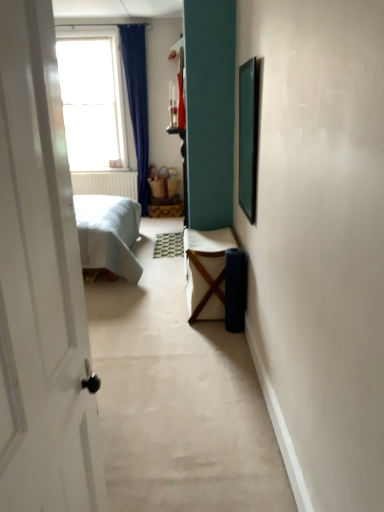
Question: Is green matte picture frame at upper right oriented towards white fabric chair at center?

Choices:
 (A) yes
 (B) no

Answer: (B)

Question: Is green matte picture frame at upper right far away from white fabric chair at center?

Choices:
 (A) yes
 (B) no

Answer: (B)

Question: Is green matte picture frame at upper right with white fabric chair at center?

Choices:
 (A) yes
 (B) no

Answer: (B)

Question: Is the depth of green matte picture frame at upper right greater than that of white fabric chair at center?

Choices:
 (A) yes
 (B) no

Answer: (B)

Question: Is green matte picture frame at upper right to the left of white fabric chair at center from the viewer's perspective?

Choices:
 (A) yes
 (B) no

Answer: (B)

Question: Is white fabric chair at center inside or outside of transparent glass window at upper left?

Choices:
 (A) inside
 (B) outside

Answer: (B)

Question: Based on their positions, is white fabric chair at center located to the left or right of transparent glass window at upper left?

Choices:
 (A) right
 (B) left

Answer: (A)

Question: Is white fabric chair at center in front of or behind transparent glass window at upper left in the image?

Choices:
 (A) behind
 (B) front

Answer: (B)

Question: In terms of width, does white fabric chair at center look wider or thinner when compared to transparent glass window at upper left?

Choices:
 (A) wide
 (B) thin

Answer: (A)

Question: Does point (243, 105) appear closer or farther from the camera than point (215, 261)?

Choices:
 (A) farther
 (B) closer

Answer: (A)

Question: Considering the positions of green matte picture frame at upper right and white fabric chair at center in the image, is green matte picture frame at upper right wider or thinner than white fabric chair at center?

Choices:
 (A) wide
 (B) thin

Answer: (B)

Question: Visually, is green matte picture frame at upper right positioned to the left or to the right of white fabric chair at center?

Choices:
 (A) left
 (B) right

Answer: (B)

Question: Is green matte picture frame at upper right situated inside white fabric chair at center or outside?

Choices:
 (A) inside
 (B) outside

Answer: (B)

Question: Does point pyautogui.click(x=213, y=285) appear closer or farther from the camera than point pyautogui.click(x=249, y=151)?

Choices:
 (A) closer
 (B) farther

Answer: (B)

Question: Would you say white fabric chair at center is to the left or to the right of green matte picture frame at upper right in the picture?

Choices:
 (A) left
 (B) right

Answer: (A)